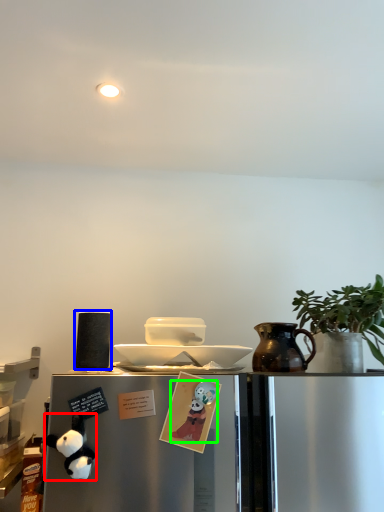
Question: Estimate the real-world distances between objects in this image. Which object is closer to toy (highlighted by a red box), appliance (highlighted by a blue box) or toy (highlighted by a green box)?

Choices:
 (A) appliance
 (B) toy

Answer: (A)